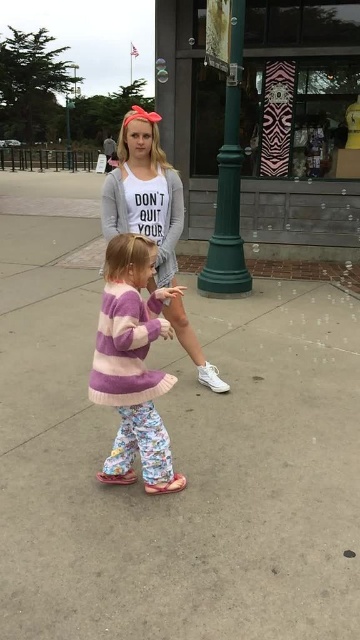
Is green matte pole at center in front of green metal pole at upper center?

Yes, it is in front of green metal pole at upper center.

This screenshot has width=360, height=640. What do you see at coordinates (228, 182) in the screenshot?
I see `green matte pole at center` at bounding box center [228, 182].

This screenshot has width=360, height=640. What are the coordinates of `green matte pole at center` in the screenshot? It's located at (228, 182).

Between point (115, 444) and point (102, 221), which one is positioned behind?

The point (102, 221) is behind.

Is purple knit sweater at center further to camera compared to matte gray sweatshirt at center?

That is False.

Find the location of `purple knit sweater at center`. purple knit sweater at center is located at coordinates (132, 365).

Is gray concrete pavement at center closer to the viewer compared to purple knit sweater at center?

Yes.

Who is more forward, (106, 492) or (155, 374)?

Positioned in front is point (155, 374).

Is point (236, 374) less distant than point (96, 371)?

No, it is behind (96, 371).

Locate an element on the screen. gray concrete pavement at center is located at coordinates (173, 451).